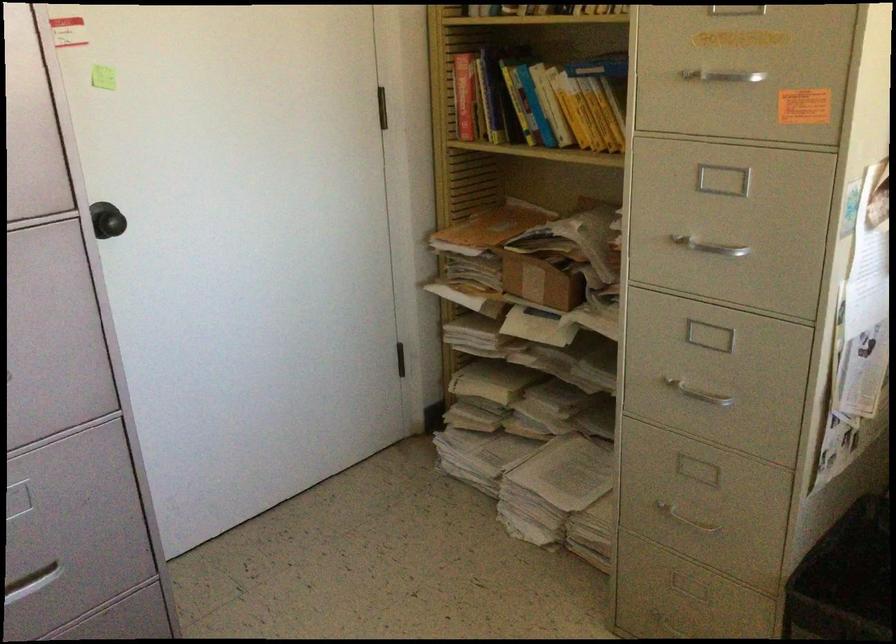
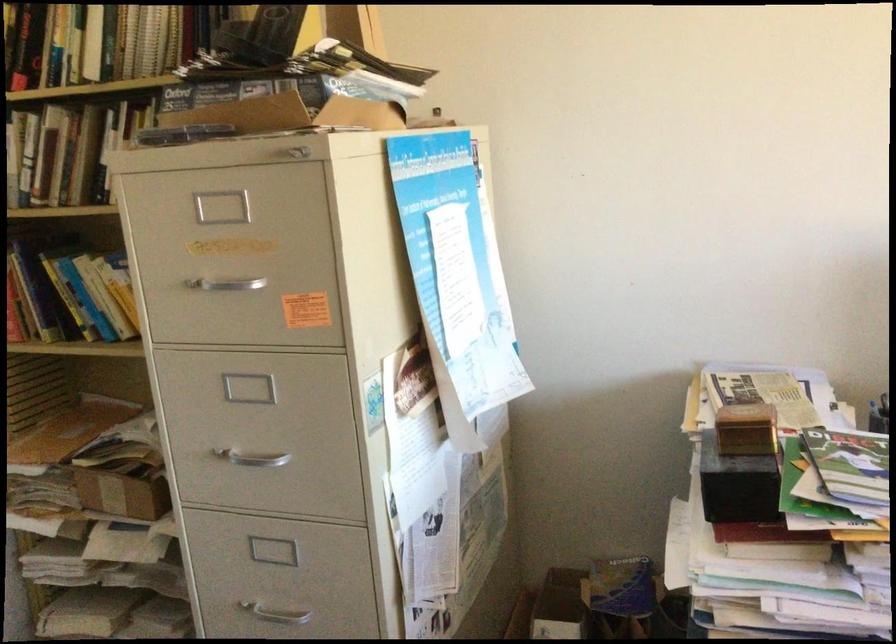
Question: I am providing you with two images of the same scene from different viewpoints. Which of the following objects are not visible in image2?

Choices:
 (A) book
 (B) small cardboard box
 (C) yellow book
 (D) kettle lid handle

Answer: (C)